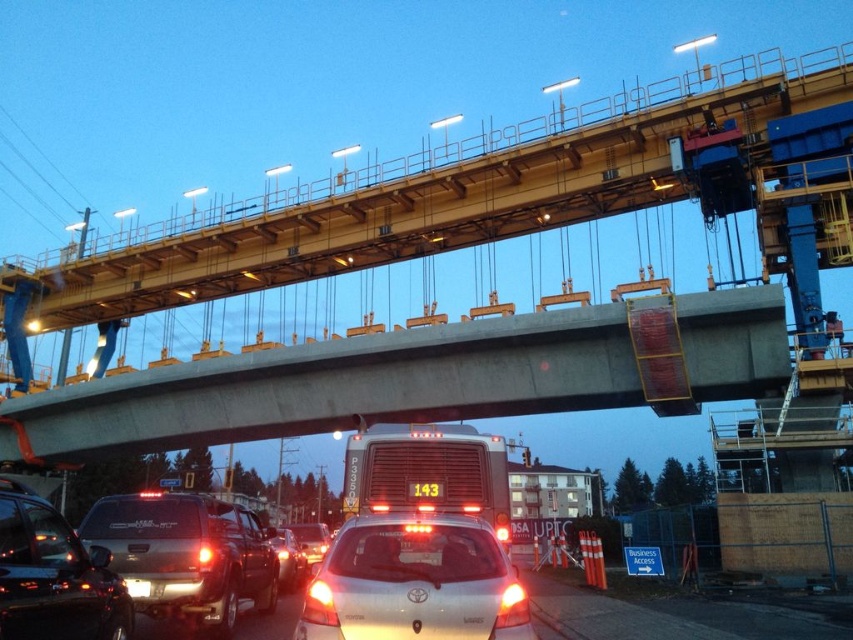
You are standing at the construction site and want to locate two specific points on the image. The first point is at coordinates point (349, 524) and the second is at point (68, 568). Which of these points is closer to your viewpoint?

Point (68, 568) is closer to your viewpoint because the description states that point (349, 524) is further away from the camera than point (68, 568).

You are a traffic officer observing the construction site. You notice the matte black suv at center and the white plastic license plate at center. Which object is higher in position?

The matte black suv at center is taller than the white plastic license plate at center.